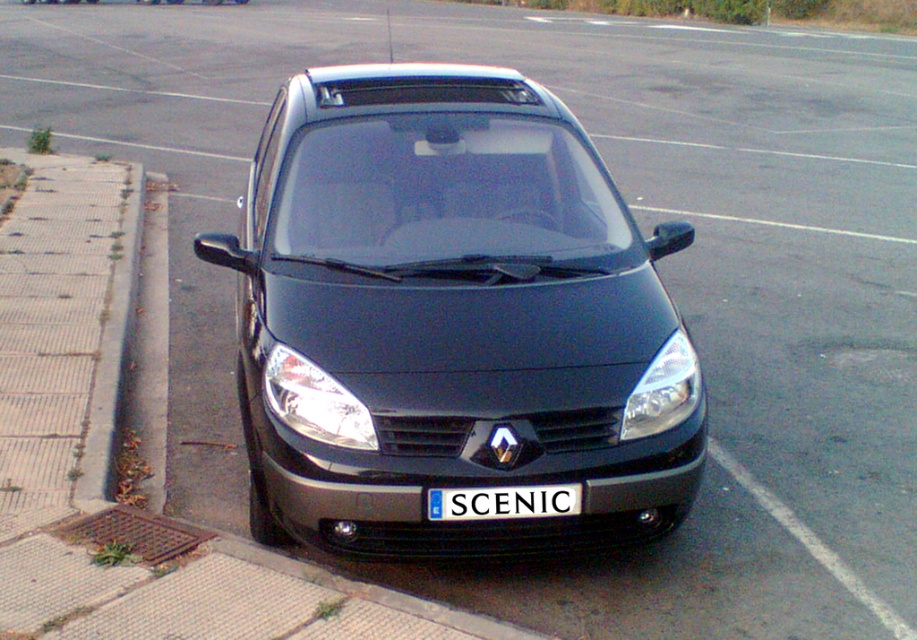
You are standing in a parking lot and see a car represented by the point at coordinates (x=451, y=321). What color is the car?

The car represented by the point at coordinates (x=451, y=321) is matte black.

You are a parking attendant and need to ensure that the matte black car at center and the white plastic license plate at center are visible in the security camera feed. The camera has a fixed height. Which object will appear larger in the camera feed?

The matte black car at center is taller than the white plastic license plate at center, so it will appear larger in the camera feed.